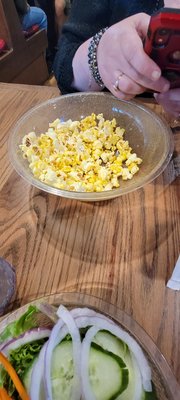
This screenshot has height=400, width=180. What are the coordinates of `table` in the screenshot? It's located at (82, 285).